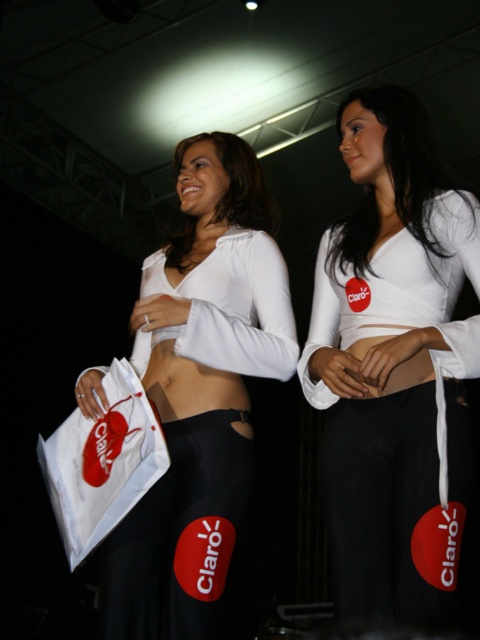
Question: Which point appears farthest from the camera in this image?

Choices:
 (A) (241, 150)
 (B) (116, 428)
 (C) (365, 294)

Answer: (A)

Question: Does white matte fabric top at center come behind white paper bag at center?

Choices:
 (A) no
 (B) yes

Answer: (A)

Question: Considering the real-world distances, which object is closest to the white paper bag at center?

Choices:
 (A) white matte fabric top at center
 (B) white matte top at center

Answer: (B)

Question: Estimate the real-world distances between objects in this image. Which object is farther from the white matte fabric top at center?

Choices:
 (A) white matte top at center
 (B) white paper bag at center

Answer: (B)

Question: Is white matte top at center closer to the viewer compared to white paper bag at center?

Choices:
 (A) no
 (B) yes

Answer: (B)

Question: From the image, what is the correct spatial relationship of white matte fabric top at center in relation to white matte top at center?

Choices:
 (A) above
 (B) below

Answer: (A)